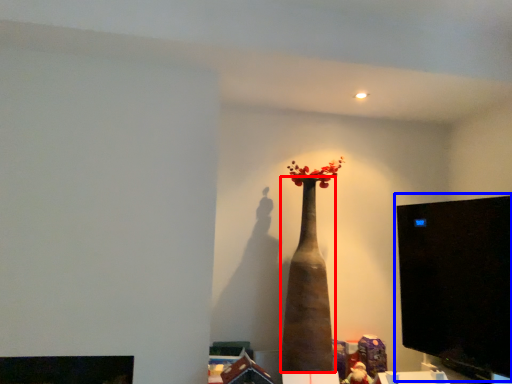
Question: Which object is closer to the camera taking this photo, vase (highlighted by a red box) or computer monitor (highlighted by a blue box)?

Choices:
 (A) vase
 (B) computer monitor

Answer: (B)